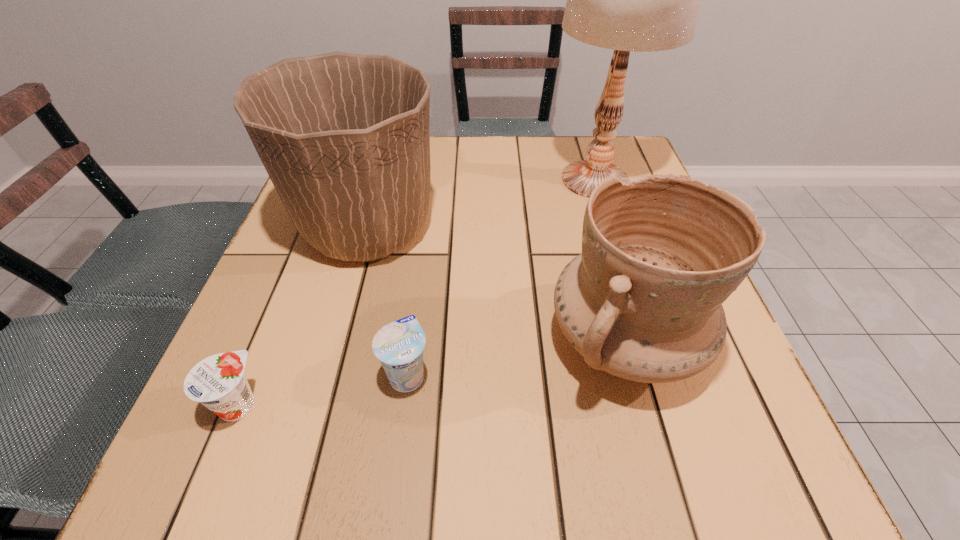
You are a GUI agent. You are given a task and a screenshot of the screen. Output one action in this format:
    pyautogui.click(x=<x>, y=<y>)
    Task: Click on the vacant area that lies between the right yogurt and the tallest object
    Image resolution: width=960 pixels, height=540 pixels.
    Given the screenshot: What is the action you would take?
    pyautogui.click(x=501, y=277)

Where is `free point between the shorter yogurt and the flowerpot`? This screenshot has width=960, height=540. free point between the shorter yogurt and the flowerpot is located at coordinates (302, 316).

The height and width of the screenshot is (540, 960). What are the coordinates of `unoccupied position between the tallest object and the right yogurt` in the screenshot? It's located at (501, 277).

This screenshot has width=960, height=540. Identify the location of vacant space in between the right yogurt and the left yogurt. (323, 389).

Find the location of a particular element. object that is the third closest one to the pottery is located at coordinates (642, 0).

I want to click on the closest object to the right yogurt, so click(x=344, y=137).

You are a GUI agent. You are given a task and a screenshot of the screen. Output one action in this format:
    pyautogui.click(x=<x>, y=<y>)
    Task: Click on the vacant region that satisfies the following two spatial constraints: 1. on the back side of the right yogurt; 2. on the left side of the tallest object
    This screenshot has height=540, width=960.
    Given the screenshot: What is the action you would take?
    pyautogui.click(x=433, y=180)

I want to click on vacant space that satisfies the following two spatial constraints: 1. on the back side of the flowerpot; 2. on the right side of the left yogurt, so click(x=311, y=227).